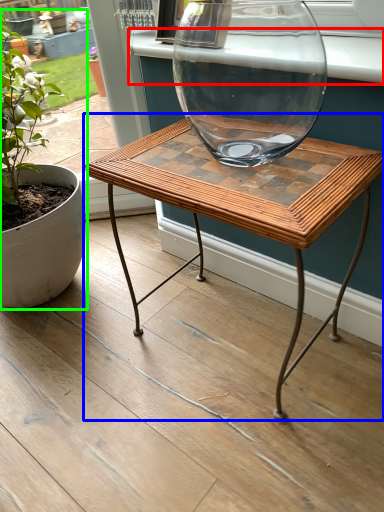
Question: Based on their relative distances, which object is farther from window sill (highlighted by a red box)? Choose from coffee table (highlighted by a blue box) and houseplant (highlighted by a green box).

Choices:
 (A) coffee table
 (B) houseplant

Answer: (B)